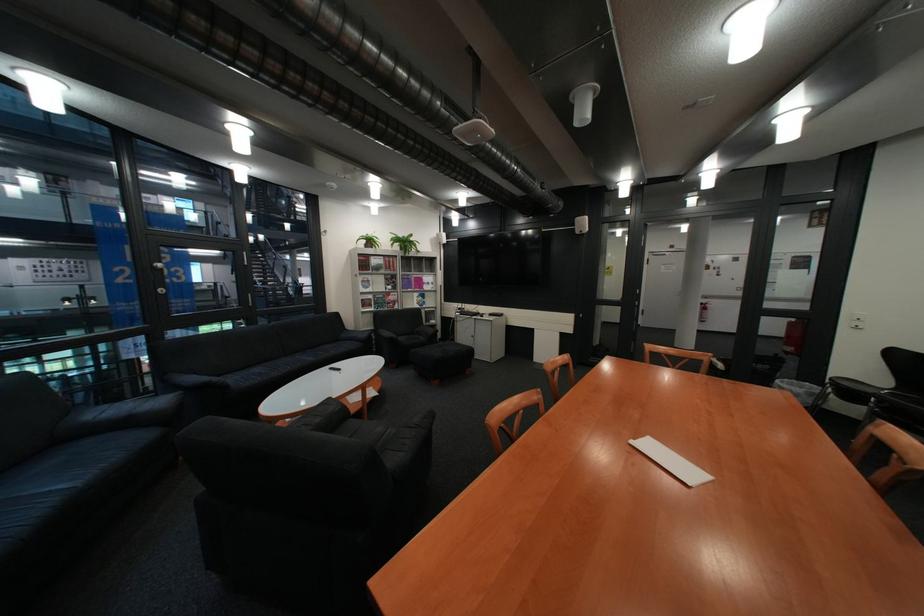
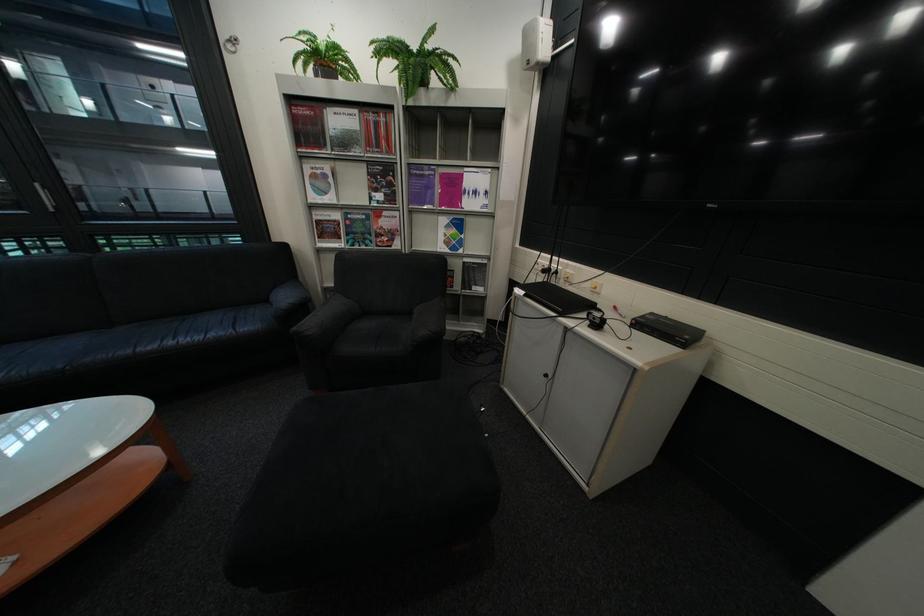
Find the pixel in the second image that matches (x=475, y=314) in the first image.

(538, 293)